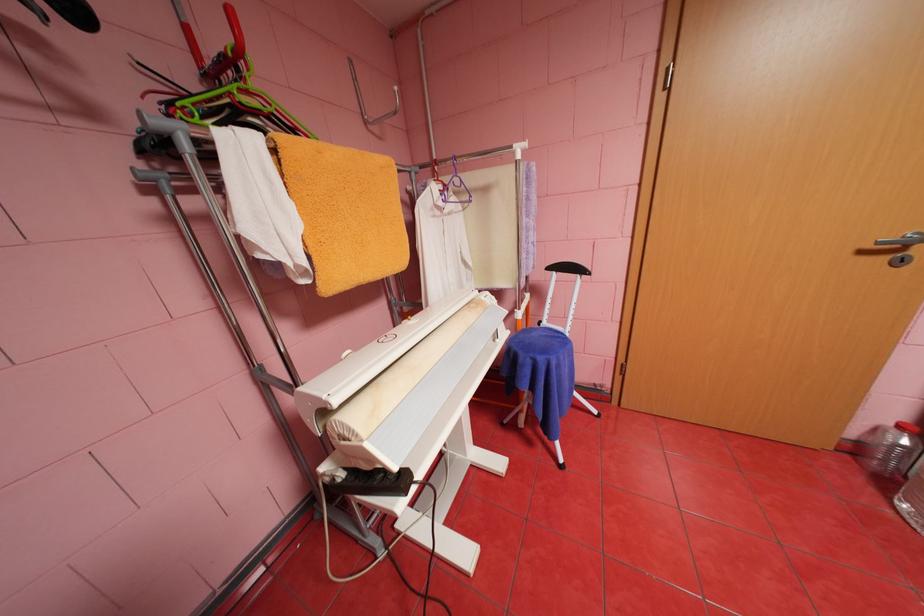
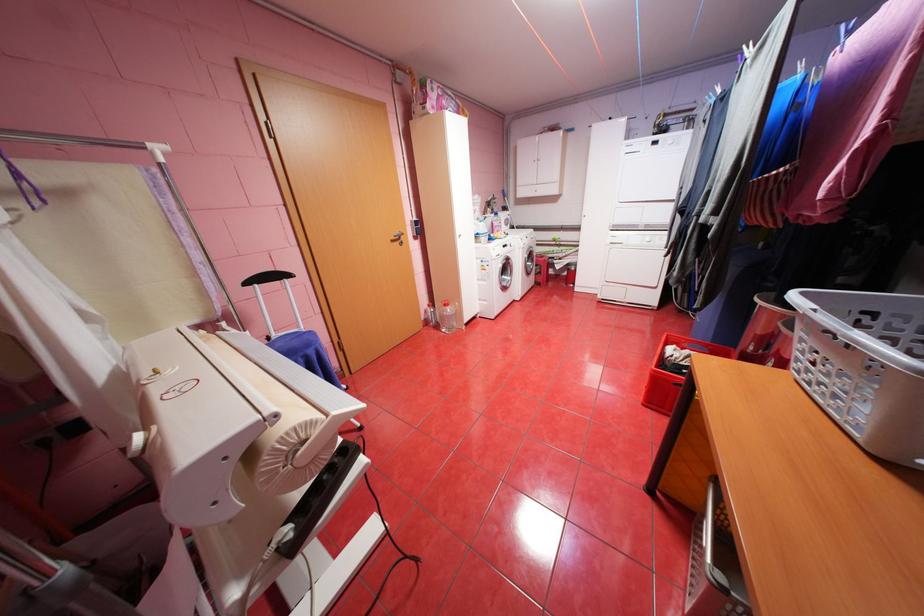
Locate, in the second image, the point that corresponds to (x=870, y=252) in the first image.

(400, 241)